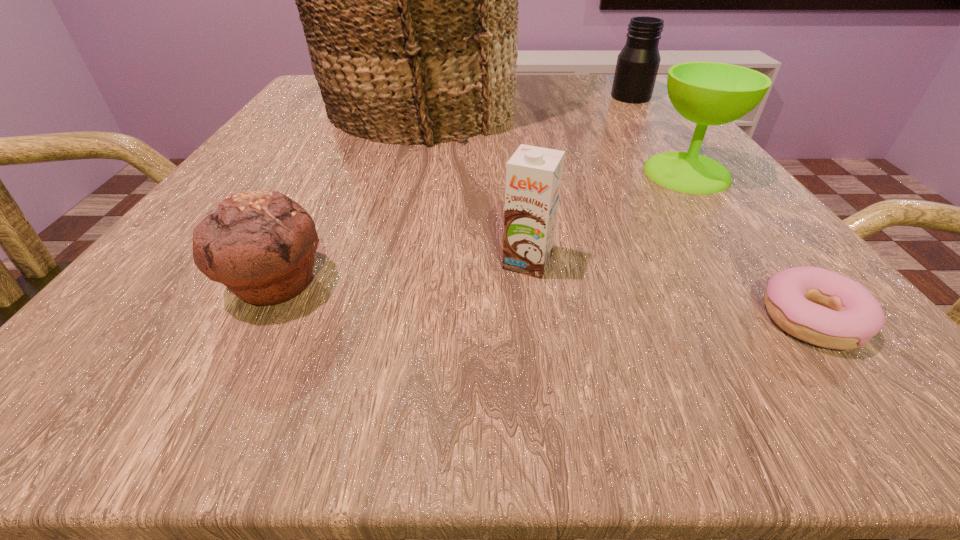
I want to click on doughnut located in the right edge section of the desktop, so click(x=824, y=308).

Locate an element on the screen. The image size is (960, 540). object at the far left corner is located at coordinates (409, 0).

At what (x,y) coordinates should I click in order to perform the action: click on object present at the near left corner. Please return your answer as a coordinate pair (x, y). Looking at the image, I should click on (260, 244).

Where is `object that is at the far right corner`? The image size is (960, 540). object that is at the far right corner is located at coordinates (637, 66).

Identify the location of object present at the near right corner. The height and width of the screenshot is (540, 960). (824, 308).

Where is `vacant space at the far edge of the desktop`? This screenshot has height=540, width=960. vacant space at the far edge of the desktop is located at coordinates (568, 112).

The image size is (960, 540). In the image, there is a desktop. In order to click on vacant area at the near edge in this screenshot , I will do `click(618, 380)`.

Identify the location of free location at the left edge. (284, 184).

Identify the location of vacant space at the right edge of the desktop. The height and width of the screenshot is (540, 960). (623, 131).

Find the location of a particular element. vacant position at the near left corner of the desktop is located at coordinates (126, 321).